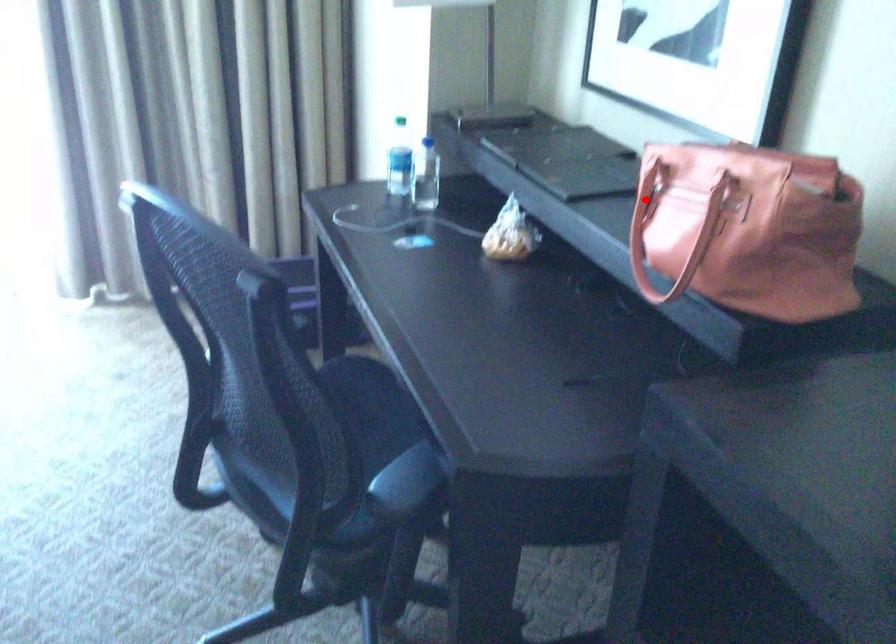
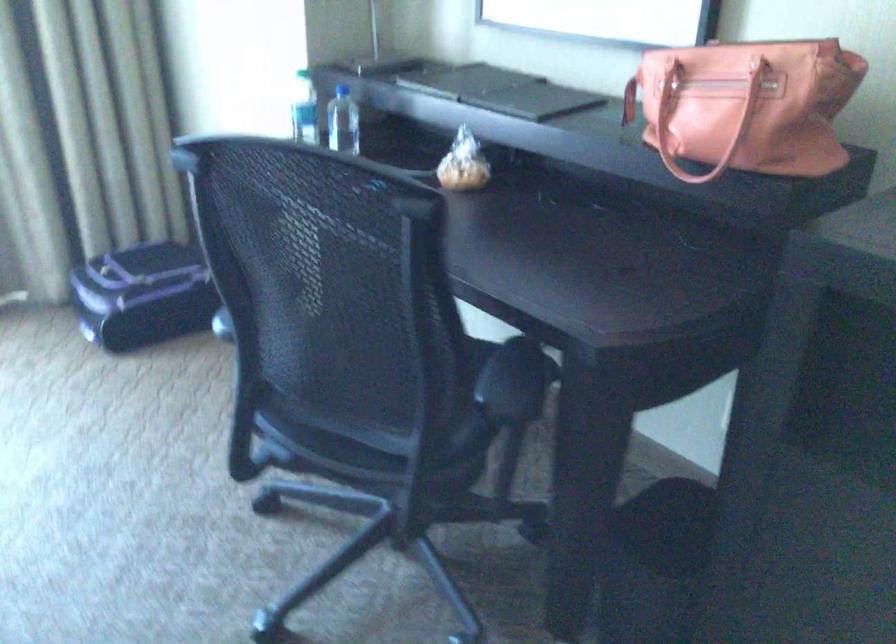
In the second image, find the point that corresponds to the highlighted location in the first image.

(629, 100)